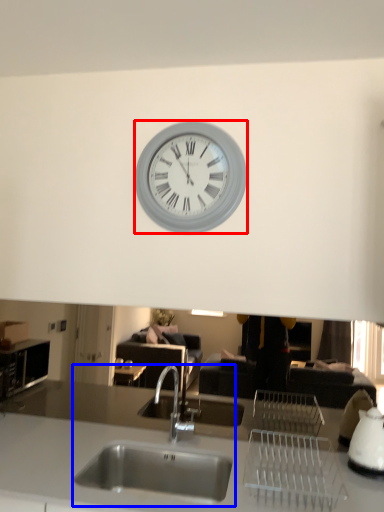
Question: Which of the following is the farthest to the observer, wall clock (highlighted by a red box) or sink (highlighted by a blue box)?

Choices:
 (A) wall clock
 (B) sink

Answer: (A)